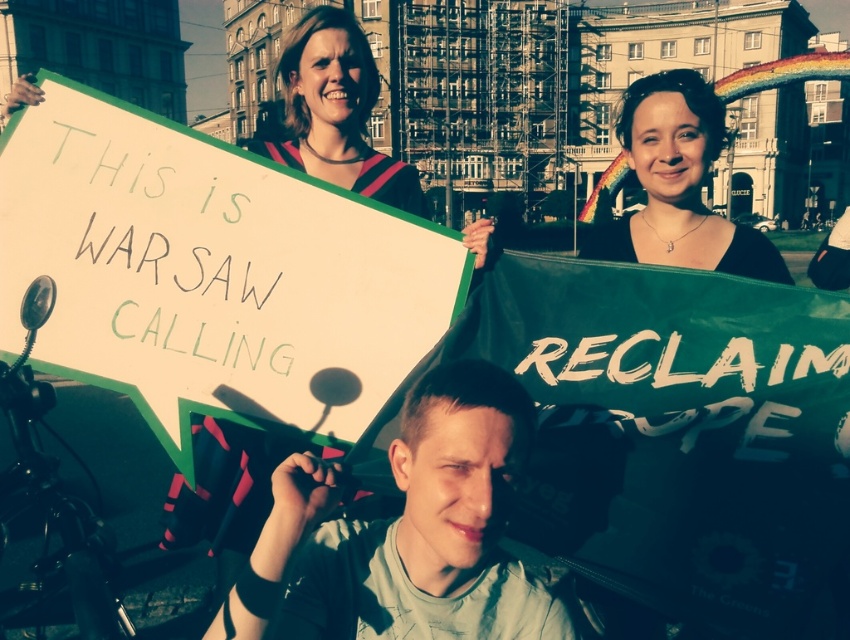
Between point (78, 275) and point (745, 259), which one is positioned in front?

Point (78, 275)

Is white paper sign at upper left below matte black hair at upper center?

Indeed, white paper sign at upper left is positioned under matte black hair at upper center.

Is point (270, 224) more distant than point (698, 177)?

No, it is not.

Identify the location of white paper sign at upper left. This screenshot has width=850, height=640. (214, 273).

Does light gray cotton shirt at center appear under matte black hair at upper center?

Indeed, light gray cotton shirt at center is positioned under matte black hair at upper center.

Is light gray cotton shirt at center to the left of matte black hair at upper center from the viewer's perspective?

Correct, you'll find light gray cotton shirt at center to the left of matte black hair at upper center.

Between point (412, 412) and point (692, 118), which one is positioned behind?

Point (692, 118)

You are a GUI agent. You are given a task and a screenshot of the screen. Output one action in this format:
    pyautogui.click(x=<x>, y=<y>)
    Task: Click on the light gray cotton shirt at center
    The image size is (850, 640).
    Given the screenshot: What is the action you would take?
    pyautogui.click(x=405, y=532)

Can you confirm if white paper sign at upper left is bigger than light gray cotton shirt at center?

Yes.

The height and width of the screenshot is (640, 850). Find the location of `white paper sign at upper left`. white paper sign at upper left is located at coordinates (214, 273).